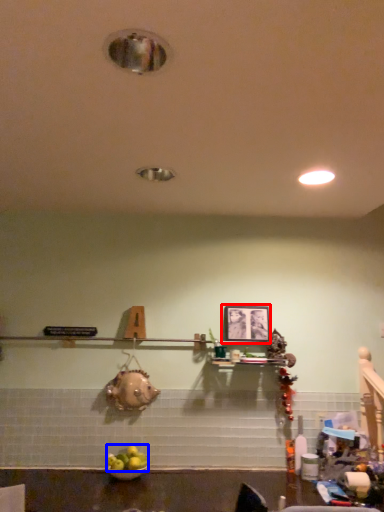
Question: Which object is further to the camera taking this photo, picture frame (highlighted by a red box) or fruit (highlighted by a blue box)?

Choices:
 (A) picture frame
 (B) fruit

Answer: (A)